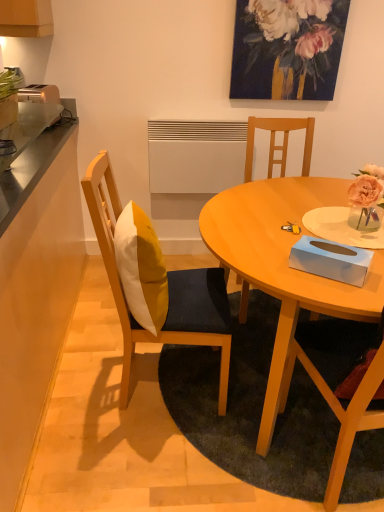
Find the location of a particular element. free point above matte wood table at center (from a real-world perspective) is located at coordinates (284, 214).